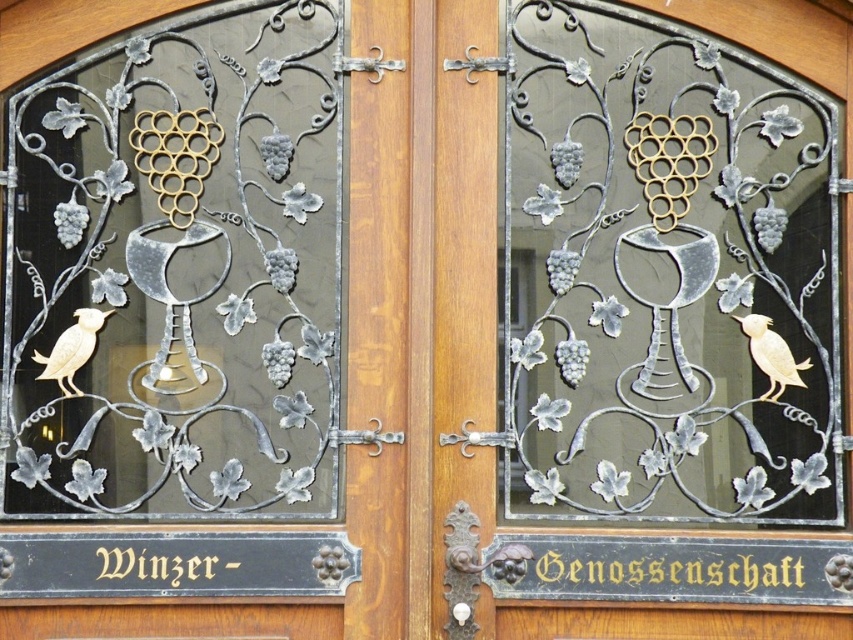
Who is more distant from viewer, (74, 390) or (780, 388)?

The point (780, 388) is more distant.

Does gold metallic bird at left have a smaller size compared to gold matte bird at right?

No.

Where is `gold metallic bird at left`? gold metallic bird at left is located at coordinates (73, 349).

Is metallic silver chalice at center bigger than gold metallic bird at left?

Yes, metallic silver chalice at center is bigger than gold metallic bird at left.

Does point (688, 416) lie in front of point (86, 340)?

Yes, it is in front of point (86, 340).

Identify the location of metallic silver chalice at center. Image resolution: width=853 pixels, height=640 pixels. (631, 323).

Is matte silver chalice at center smaller than gold metallic bird at left?

No, matte silver chalice at center is not smaller than gold metallic bird at left.

Does matte silver chalice at center appear under gold metallic bird at left?

No, matte silver chalice at center is not below gold metallic bird at left.

Measure the distance between point (316, 163) and camera.

Point (316, 163) is 272.58 feet away from camera.

Locate an element on the screen. matte silver chalice at center is located at coordinates (274, 342).